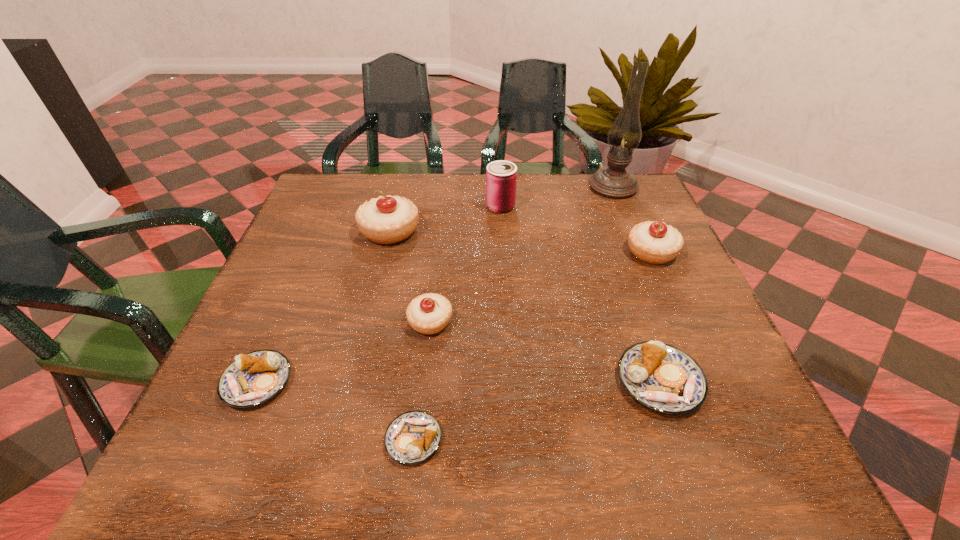
The height and width of the screenshot is (540, 960). I want to click on the tallest object, so click(613, 181).

Identify the location of oil lamp. This screenshot has width=960, height=540. (613, 181).

Locate an element on the screen. This screenshot has width=960, height=540. the fourth object from right to left is located at coordinates (501, 176).

Image resolution: width=960 pixels, height=540 pixels. Find the location of `pink can`. pink can is located at coordinates coord(501,176).

The width and height of the screenshot is (960, 540). Identify the location of the biggest beige pastry. (391, 219).

Identify the location of the tallest pastry. The width and height of the screenshot is (960, 540). (391, 219).

Where is `the second biggest beige pastry`? the second biggest beige pastry is located at coordinates (653, 242).

This screenshot has width=960, height=540. What are the coordinates of `the fourth tallest object` in the screenshot? It's located at (653, 242).

Identify the location of the nearest beige pastry. (428, 314).

Image resolution: width=960 pixels, height=540 pixels. Identify the location of the fourth shortest object. (428, 314).